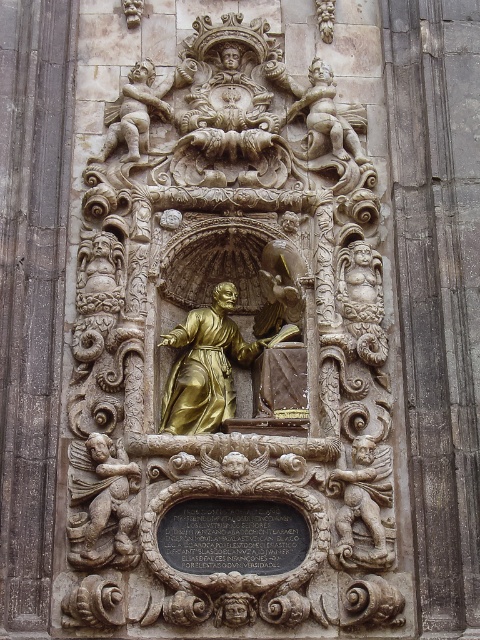
In the scene shown: Who is positioned more to the right, gold polished statue at center or carved stone cherub at lower left?

From the viewer's perspective, gold polished statue at center appears more on the right side.

Between point (358, 403) and point (72, 547), which one is positioned behind?

Positioned behind is point (358, 403).

Where is `gold polished statue at center`? gold polished statue at center is located at coordinates (229, 355).